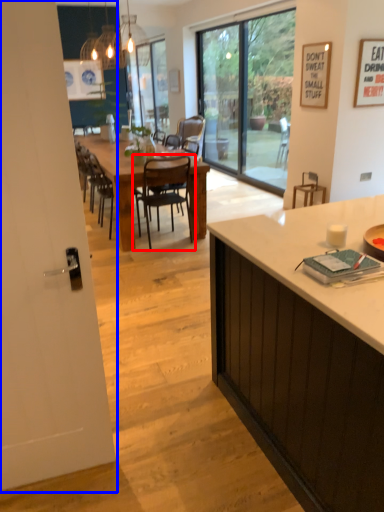
Question: Which point is further to the camera, chair (highlighted by a red box) or screen door (highlighted by a blue box)?

Choices:
 (A) chair
 (B) screen door

Answer: (A)